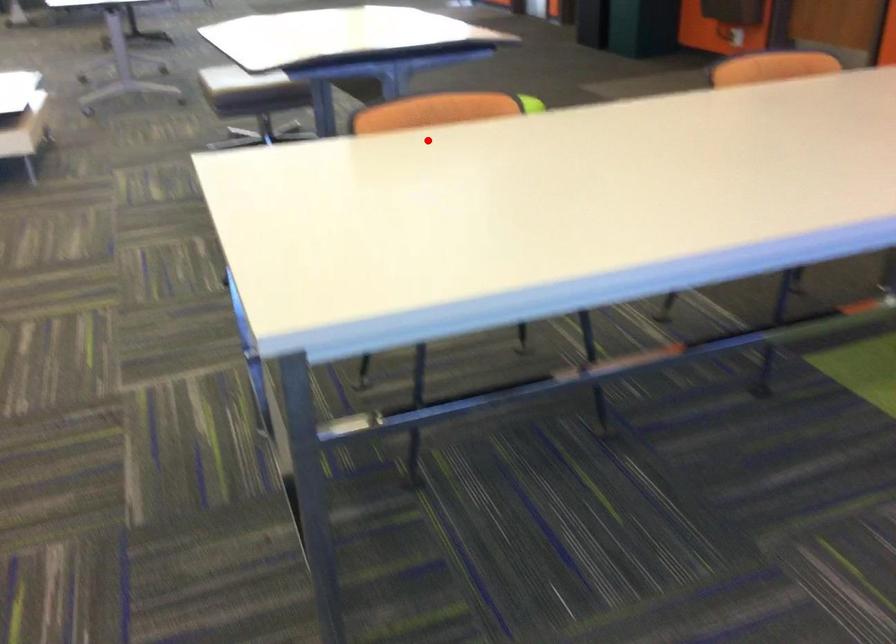
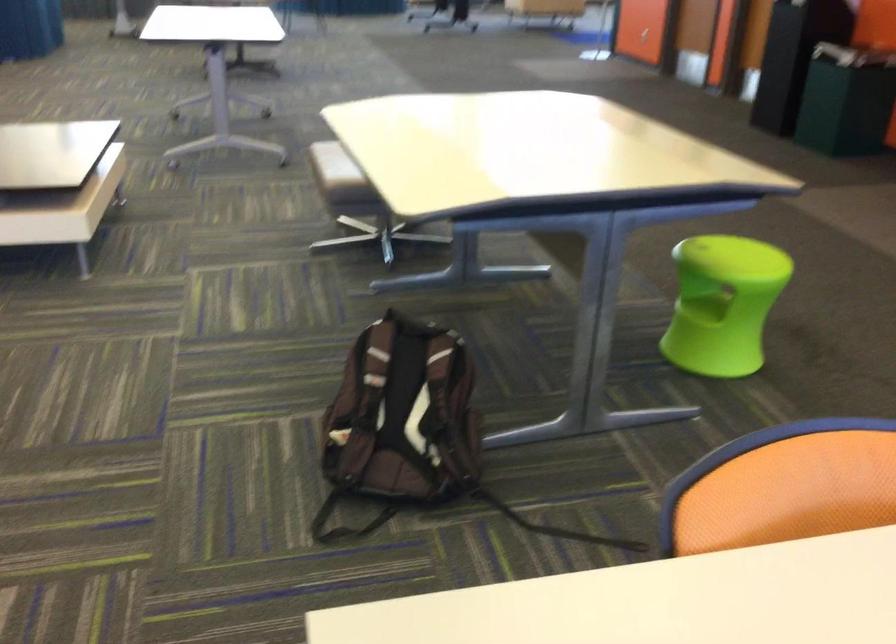
Where in the second image is the point corresponding to the highlighted location from the first image?

(832, 585)